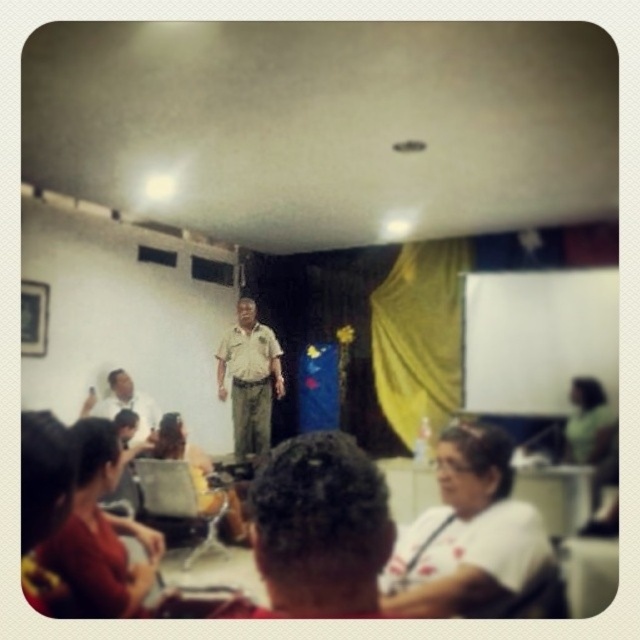
Question: Is khaki uniform at center further to camera compared to matte khaki uniform at lower left?

Choices:
 (A) yes
 (B) no

Answer: (A)

Question: Which object is the closest to the khaki uniform at center?

Choices:
 (A) white matte shirt at lower center
 (B) white cotton shirt at center

Answer: (B)

Question: Which of these objects is positioned closest to the white cotton shirt at center?

Choices:
 (A) khaki uniform at center
 (B) matte khaki uniform at lower left

Answer: (A)

Question: Observing the image, what is the correct spatial positioning of khaki uniform at center in reference to matte khaki uniform at lower left?

Choices:
 (A) above
 (B) below

Answer: (A)

Question: Which point appears closest to the camera in this image?

Choices:
 (A) (454, 588)
 (B) (259, 413)
 (C) (93, 392)

Answer: (A)

Question: Does white matte shirt at lower center appear under khaki uniform at center?

Choices:
 (A) yes
 (B) no

Answer: (A)